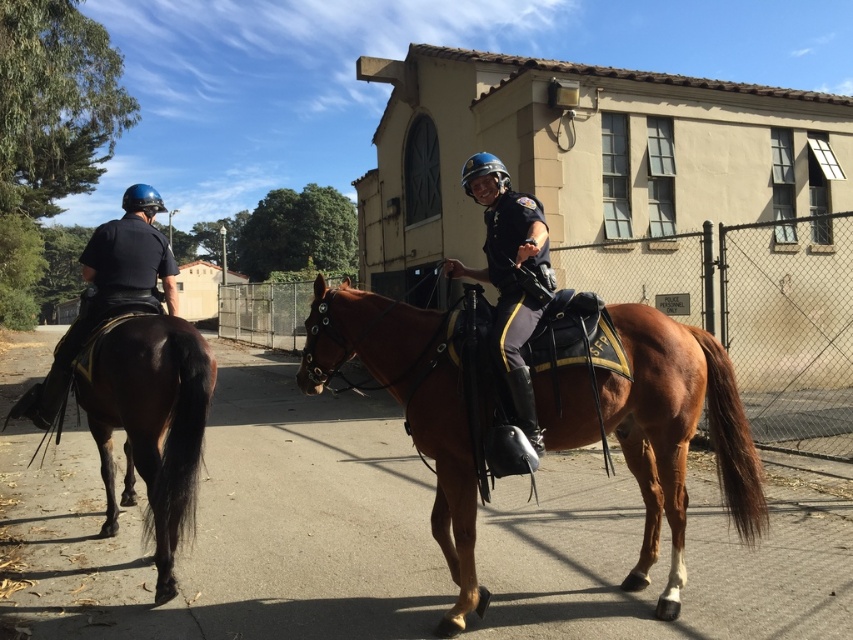
Where is the brown leather saddle at center located in the image?

The brown leather saddle at center is located at point (676, 433) in the image.

You are a photographer standing at point (x=149, y=422). You want to take a picture of the brown glossy horse at left. Is the horse visible from your current position?

Yes, the horse is visible because you are standing exactly at the point where it is located.

You are a photographer trying to capture both the brown glossy horse at left and the shiny black helmet at center in the same frame. Based on their sizes in the image, which object should you focus on first to ensure both are in focus?

The brown glossy horse at left is shorter than the shiny black helmet at center, so you should focus on the shiny black helmet at center first to ensure both are in focus.